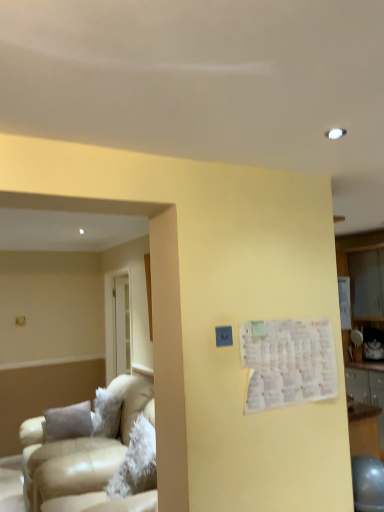
Question: Looking at the image, does white paper at upper right seem bigger or smaller compared to beige leather couch at left?

Choices:
 (A) small
 (B) big

Answer: (A)

Question: Visually, is white paper at upper right positioned to the left or to the right of beige leather couch at left?

Choices:
 (A) left
 (B) right

Answer: (B)

Question: Would you say white paper at upper right is inside or outside beige leather couch at left?

Choices:
 (A) outside
 (B) inside

Answer: (A)

Question: In terms of width, does beige leather couch at left look wider or thinner when compared to white paper at upper right?

Choices:
 (A) wide
 (B) thin

Answer: (A)

Question: From the image's perspective, relative to white paper at upper right, is beige leather couch at left above or below?

Choices:
 (A) above
 (B) below

Answer: (B)

Question: From a real-world perspective, relative to white paper at upper right, is beige leather couch at left vertically above or below?

Choices:
 (A) above
 (B) below

Answer: (B)

Question: Is beige leather couch at left in front of or behind white paper at upper right in the image?

Choices:
 (A) front
 (B) behind

Answer: (B)